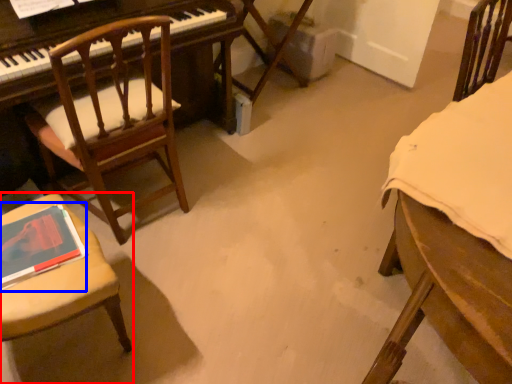
Question: Which of the following is the farthest to the observer, chair (highlighted by a red box) or book (highlighted by a blue box)?

Choices:
 (A) chair
 (B) book

Answer: (B)